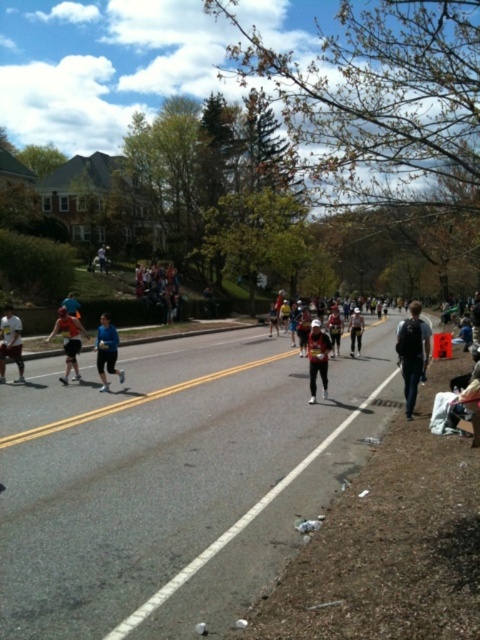
You are a runner in the marathon and you want to find your backpack. Where is the dark gray backpack at right located in the image?

The dark gray backpack at right is located at point (x=412, y=353) in the image.

You are a photographer positioned at the starting line of the marathon. You want to capture a photo where the matte black running outfit at center and the white athletic shorts at left are both visible. Considering their sizes, which object would appear smaller in the photo?

The matte black running outfit at center appears smaller in the photo because it has a lesser width compared to the white athletic shorts at left.